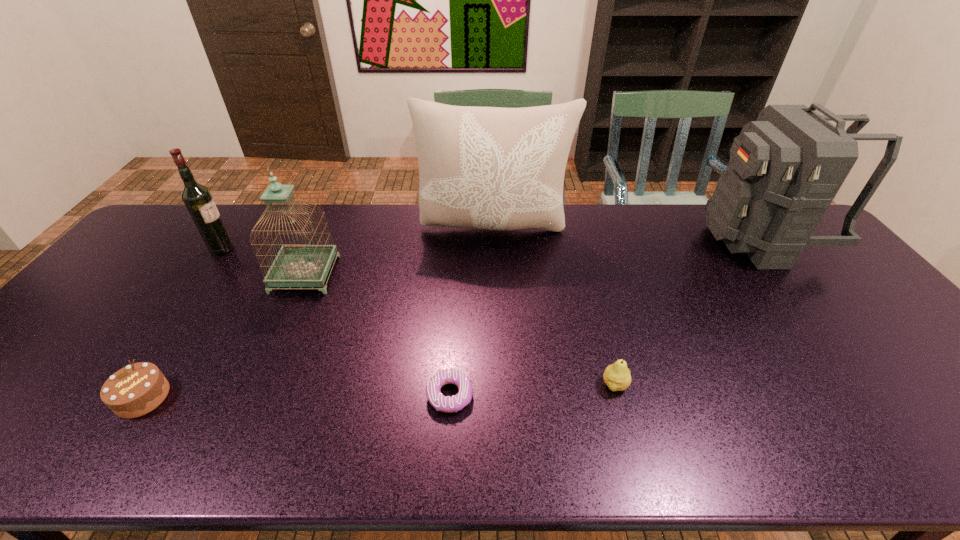
You are a GUI agent. You are given a task and a screenshot of the screen. Output one action in this format:
    pyautogui.click(x=<x>, y=<y>)
    Task: Click on the cushion
    The height and width of the screenshot is (540, 960).
    Given the screenshot: What is the action you would take?
    [494, 168]

Locate an element on the screen. the rightmost object is located at coordinates (785, 169).

This screenshot has width=960, height=540. Find the location of `the third object from left to right`. the third object from left to right is located at coordinates (296, 265).

Locate an element on the screen. Image resolution: width=960 pixels, height=540 pixels. wine bottle is located at coordinates (197, 198).

Where is `pear`? This screenshot has width=960, height=540. pear is located at coordinates tap(617, 376).

Find the location of a particular element. This screenshot has width=960, height=540. the second shortest object is located at coordinates (135, 390).

The height and width of the screenshot is (540, 960). Identify the location of the shortest object. (447, 404).

Identify the location of free region located on the front side of the cushion. This screenshot has width=960, height=540. 496,287.

The width and height of the screenshot is (960, 540). In order to click on vacant space situated on the front compartment of the rightmost object in this screenshot , I will do `click(645, 240)`.

This screenshot has width=960, height=540. In order to click on free space located on the front compartment of the rightmost object in this screenshot , I will do `click(673, 240)`.